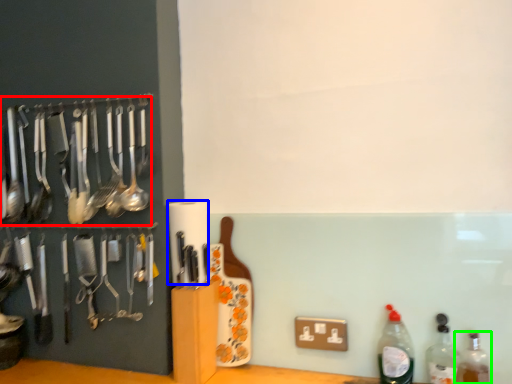
Question: Estimate the real-world distances between objects in this image. Which object is farther from spoon (highlighted by a red box), paper towel (highlighted by a blue box) or bottle (highlighted by a green box)?

Choices:
 (A) paper towel
 (B) bottle

Answer: (B)